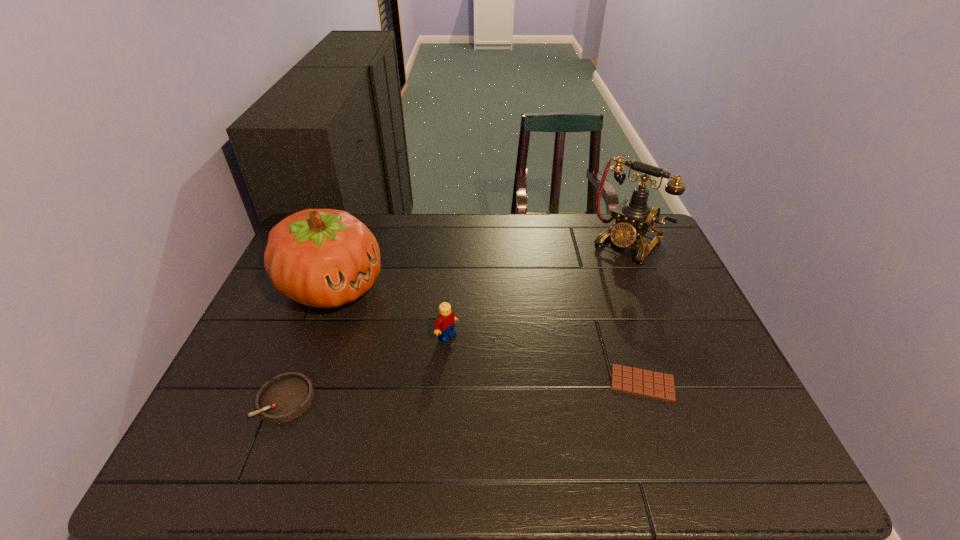
Find the location of a particular element. This screenshot has height=540, width=960. free area in between the ashtray and the shortest object is located at coordinates (465, 392).

You are a GUI agent. You are given a task and a screenshot of the screen. Output one action in this format:
    pyautogui.click(x=<x>, y=<y>)
    Task: Click on the free space between the pumpkin and the ashtray
    
    Given the screenshot: What is the action you would take?
    pyautogui.click(x=309, y=343)

What are the coordinates of `vacant point located between the telephone and the ashtray` in the screenshot? It's located at click(457, 322).

Locate an element on the screen. The width and height of the screenshot is (960, 540). vacant area that lies between the Lego and the ashtray is located at coordinates (367, 368).

What are the coordinates of `vacant area that lies between the pumpkin and the ashtray` in the screenshot? It's located at (309, 343).

I want to click on object that stands as the second closest to the third tallest object, so click(x=287, y=396).

What are the coordinates of `object that is the closest to the shortest object` in the screenshot? It's located at (444, 326).